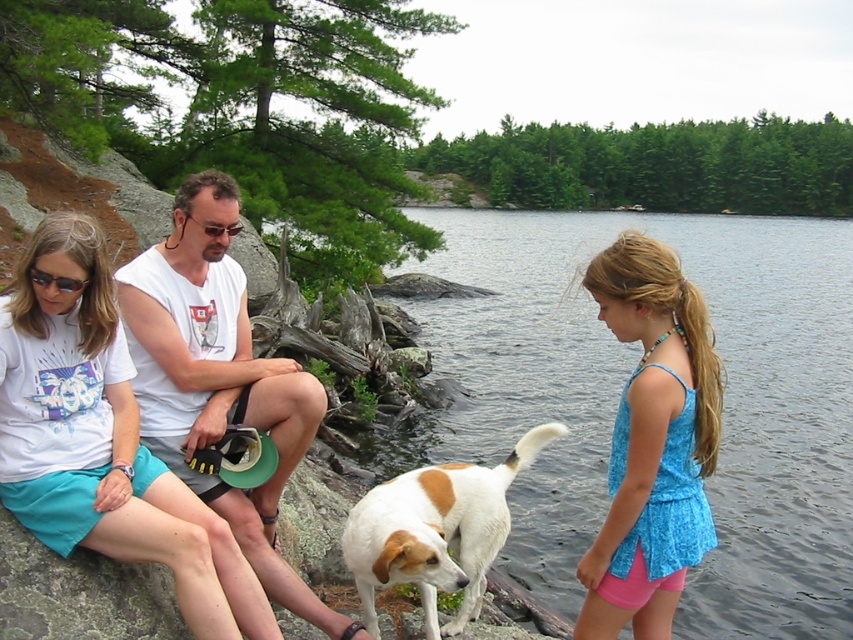
Between white fur dog at center and green rubber goggles at center, which one has less height?

green rubber goggles at center is shorter.

Is white fur dog at center bigger than green rubber goggles at center?

Yes, white fur dog at center is bigger than green rubber goggles at center.

Identify the location of white fur dog at center. The width and height of the screenshot is (853, 640). (434, 531).

Between clear water at lower right and matte black sunglasses at upper left, which one has more height?

clear water at lower right is taller.

Is point (782, 390) positioned after point (28, 276)?

That is True.

Is point (705, 600) behind point (62, 282)?

Yes, it is behind point (62, 282).

The image size is (853, 640). What are the coordinates of `clear water at lower right` in the screenshot? It's located at (619, 392).

Is point (74, 545) closer to camera compared to point (73, 284)?

No, it is behind (73, 284).

Between white cotton t-shirt at upper left and matte black sunglasses at upper left, which one has less height?

matte black sunglasses at upper left

Locate an element on the screen. The image size is (853, 640). white cotton t-shirt at upper left is located at coordinates (103, 440).